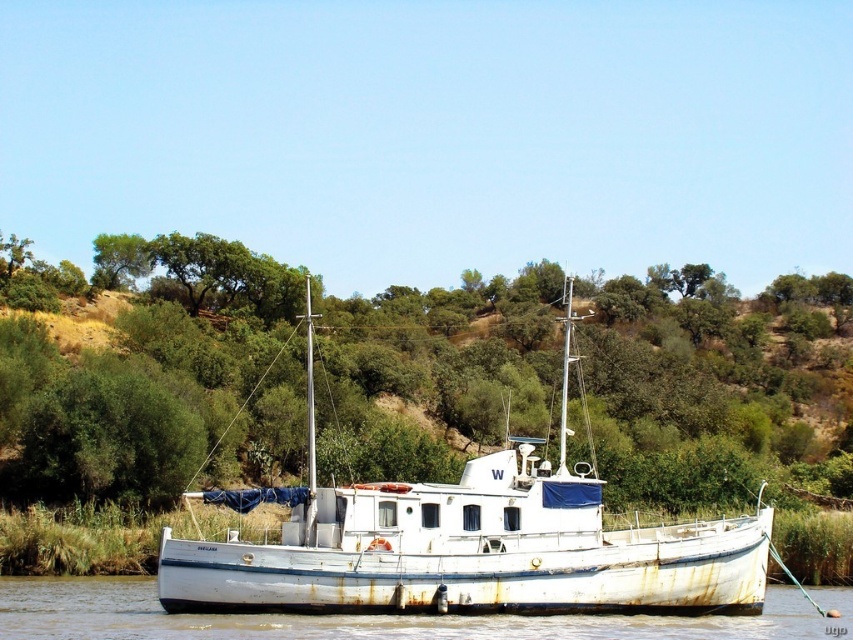
Can you confirm if white weathered wood boat at center is bigger than white matte boat at center?

Correct, white weathered wood boat at center is larger in size than white matte boat at center.

Who is more forward, (x=260, y=586) or (x=503, y=616)?

Point (x=260, y=586) is in front.

I want to click on white weathered wood boat at center, so click(466, 541).

Who is higher up, green leafy tree at center or white matte boat at center?

green leafy tree at center is above.

What do you see at coordinates (173, 372) in the screenshot? The width and height of the screenshot is (853, 640). I see `green leafy tree at center` at bounding box center [173, 372].

The height and width of the screenshot is (640, 853). I want to click on green leafy tree at center, so click(173, 372).

Is green leafy tree at center to the right of white weathered wood boat at center from the viewer's perspective?

Yes, green leafy tree at center is to the right of white weathered wood boat at center.

Can you confirm if green leafy tree at center is bigger than white weathered wood boat at center?

Indeed, green leafy tree at center has a larger size compared to white weathered wood boat at center.

Describe the element at coordinates (173, 372) in the screenshot. This screenshot has height=640, width=853. I see `green leafy tree at center` at that location.

Locate an element on the screen. The height and width of the screenshot is (640, 853). green leafy tree at center is located at coordinates (173, 372).